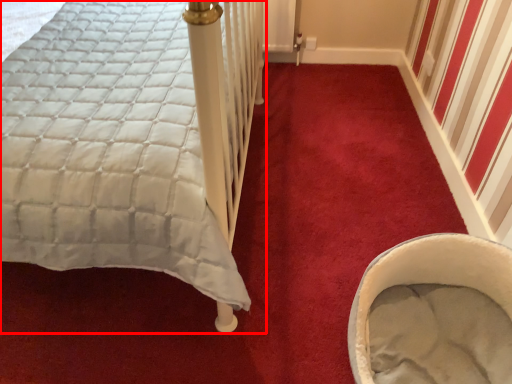
Question: In this image, where is bed (annotated by the red box) located relative to baby carriage?

Choices:
 (A) left
 (B) right

Answer: (A)